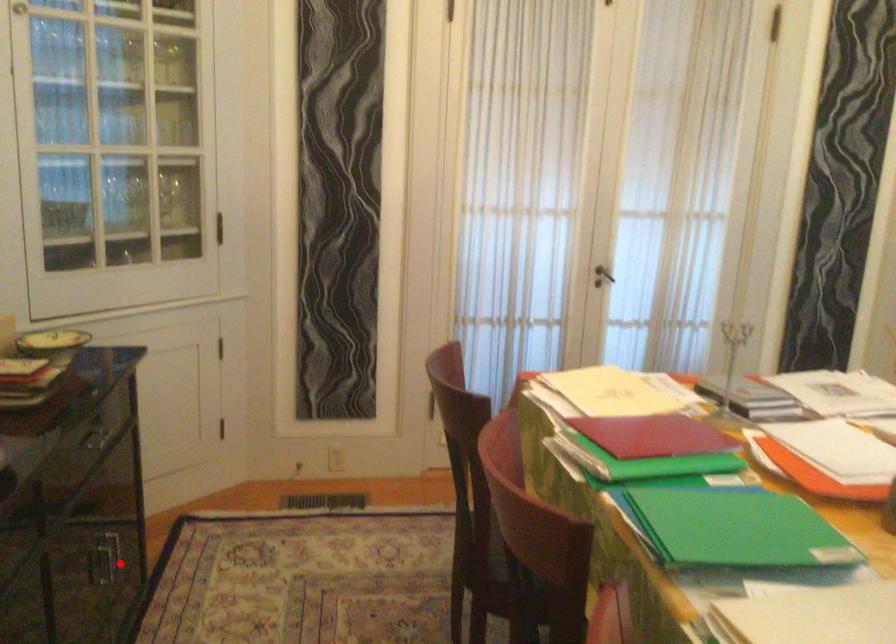
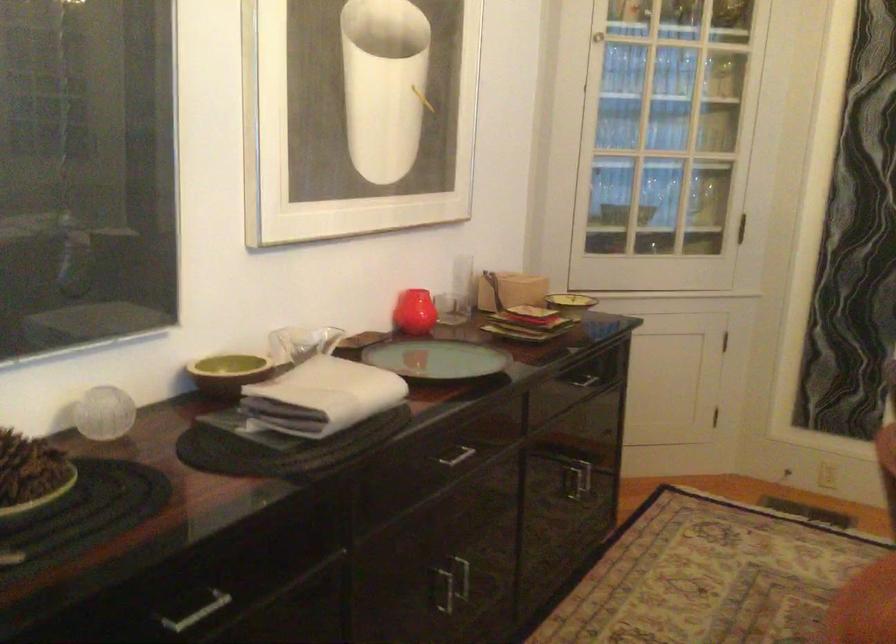
Find the pixel in the second image that matches the highlighted location in the first image.

(574, 483)